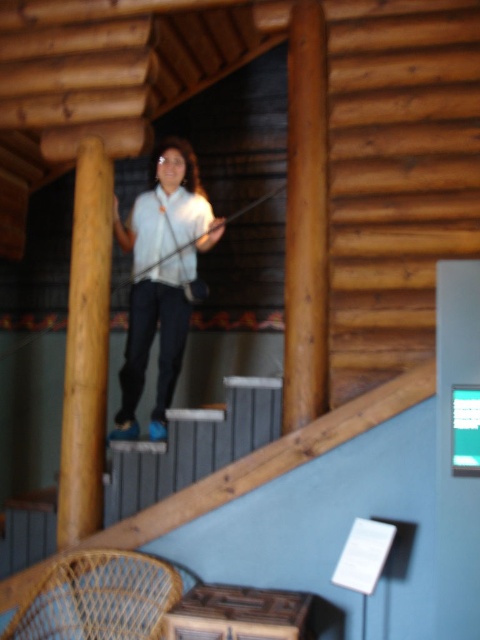
You are a visitor in the museum and want to take a photo of the matte white shirt at center. Where should you position yourself to ensure the shirt is in the frame?

The matte white shirt at center is located at point (x=162, y=276), so you should position yourself directly in front of it to ensure it is centered in your photo.

You are a visitor in the museum and notice two white shirts displayed in the exhibit. The first is labeled as the matte white shirt at center and the second as the white matte shirt at upper center. Which shirt is located to the left when viewed from your perspective?

The matte white shirt at center is positioned on the left side of the white matte shirt at upper center, so when viewed from your perspective, the matte white shirt at center is to the left.